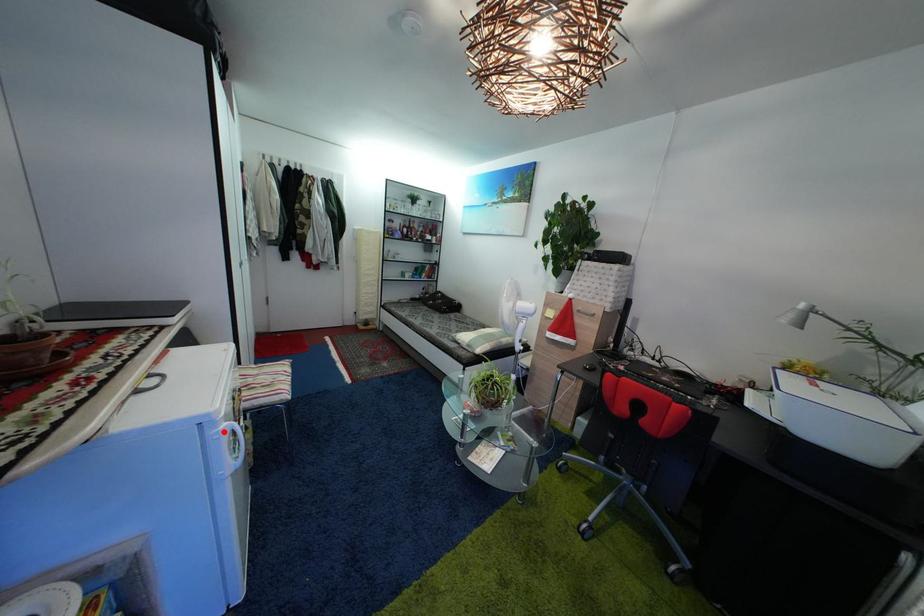
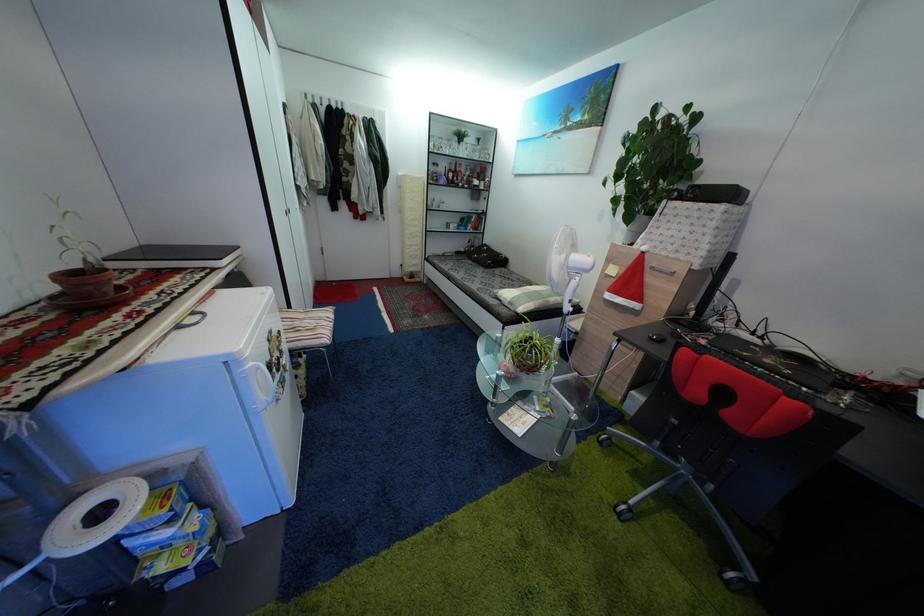
Question: A red point is marked in image1. In image2, is the corresponding 3D point closer to the camera or farther? Reply with the corresponding letter.

Choices:
 (A) The corresponding 3D point is closer.
 (B) The corresponding 3D point is farther.

Answer: (A)